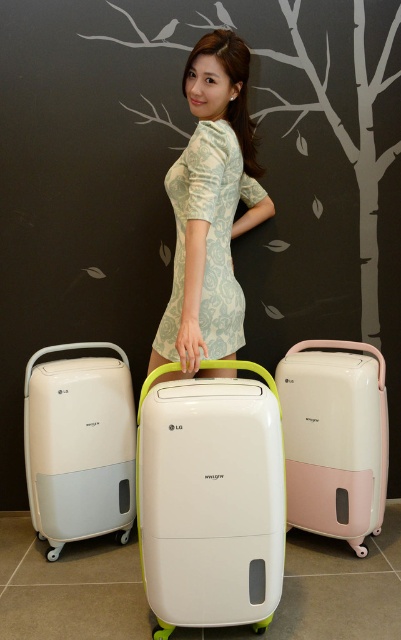
Is light blue floral dress at center taller than white matte dehumidifier at left?

Yes, light blue floral dress at center is taller than white matte dehumidifier at left.

Is light blue floral dress at center closer to camera compared to white matte dehumidifier at left?

Yes, it is.

Is point (222, 211) behind point (115, 376)?

No.

The image size is (401, 640). Find the location of `light blue floral dress at center`. light blue floral dress at center is located at coordinates (210, 208).

Is white matte suitcase at center to the right of matte white suitcase at center from the viewer's perspective?

In fact, white matte suitcase at center is to the left of matte white suitcase at center.

This screenshot has width=401, height=640. In order to click on white matte suitcase at center in this screenshot , I will do `click(210, 499)`.

Does point (192, 394) come farther from viewer compared to point (315, 413)?

No, (192, 394) is in front of (315, 413).

At what (x,y) coordinates should I click in order to perform the action: click on white matte suitcase at center. Please return your answer as a coordinate pair (x, y). The height and width of the screenshot is (640, 401). Looking at the image, I should click on (210, 499).

Is the position of light blue floral dress at center more distant than that of matte white suitcase at center?

No, it is in front of matte white suitcase at center.

At what (x,y) coordinates should I click in order to perform the action: click on light blue floral dress at center. Please return your answer as a coordinate pair (x, y). Looking at the image, I should click on (210, 208).